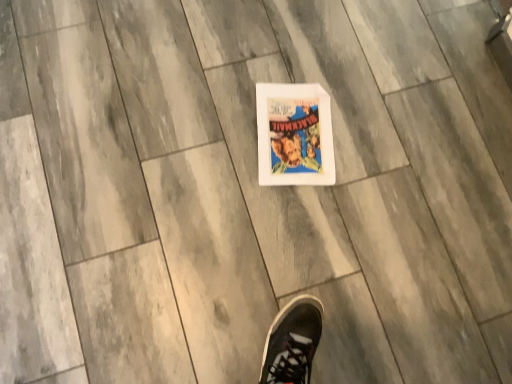
In order to click on vacant space to the right of matte paper comic book at center in this screenshot , I will do `click(393, 148)`.